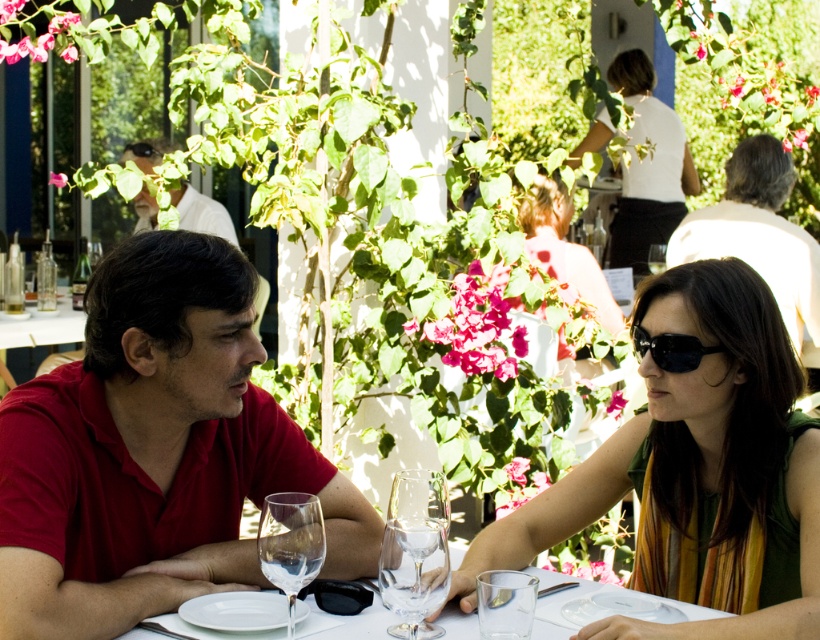
Question: Among these objects, which one is nearest to the camera?

Choices:
 (A) transparent glass wine glass at lower center
 (B) matte red shirt at center
 (C) white glassware at center
 (D) white shirt at upper left

Answer: (A)

Question: Can you confirm if black matte sunglasses at upper right is thinner than black plastic goggles at center?

Choices:
 (A) no
 (B) yes

Answer: (A)

Question: Which object appears farthest from the camera in this image?

Choices:
 (A) matte pink dress at center
 (B) matte red shirt at center
 (C) white glassware at center
 (D) matte green dress at center

Answer: (A)

Question: Which of these objects is positioned closest to the black plastic goggles at center?

Choices:
 (A) matte red shirt at center
 (B) black plastic sunglasses at center

Answer: (A)

Question: Can you confirm if matte green dress at center is smaller than black plastic goggles at center?

Choices:
 (A) no
 (B) yes

Answer: (A)

Question: From the image, what is the correct spatial relationship of transparent glass wine glass at lower center in relation to black plastic goggles at center?

Choices:
 (A) left
 (B) right

Answer: (A)